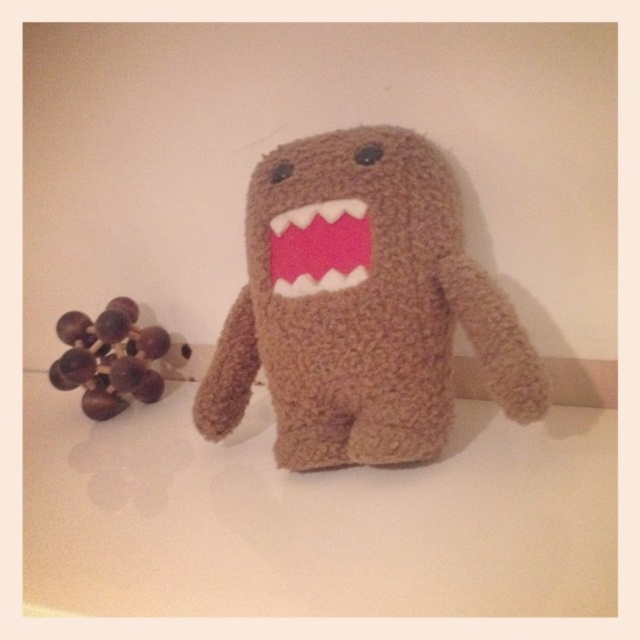
Question: Can you confirm if brown fuzzy ball at left is positioned above pink felt mouth at center?

Choices:
 (A) no
 (B) yes

Answer: (A)

Question: Which point is closer to the camera?

Choices:
 (A) pink felt mouth at center
 (B) fuzzy brown plush toy at center
 (C) brown fuzzy ball at left

Answer: (B)

Question: Which is farther from the fuzzy brown plush toy at center?

Choices:
 (A) pink felt mouth at center
 (B) brown fuzzy ball at left

Answer: (B)

Question: Which of these objects is positioned farthest from the fuzzy brown plush toy at center?

Choices:
 (A) brown fuzzy ball at left
 (B) pink felt mouth at center

Answer: (A)

Question: Is brown fuzzy ball at left closer to the viewer compared to pink felt mouth at center?

Choices:
 (A) no
 (B) yes

Answer: (A)

Question: Does fuzzy brown plush toy at center have a greater width compared to brown fuzzy ball at left?

Choices:
 (A) yes
 (B) no

Answer: (A)